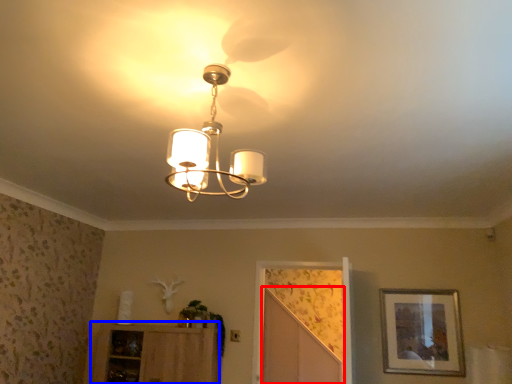
Question: Which of the following is the farthest to the observer, screen door (highlighted by a red box) or cabinetry (highlighted by a blue box)?

Choices:
 (A) screen door
 (B) cabinetry

Answer: (A)